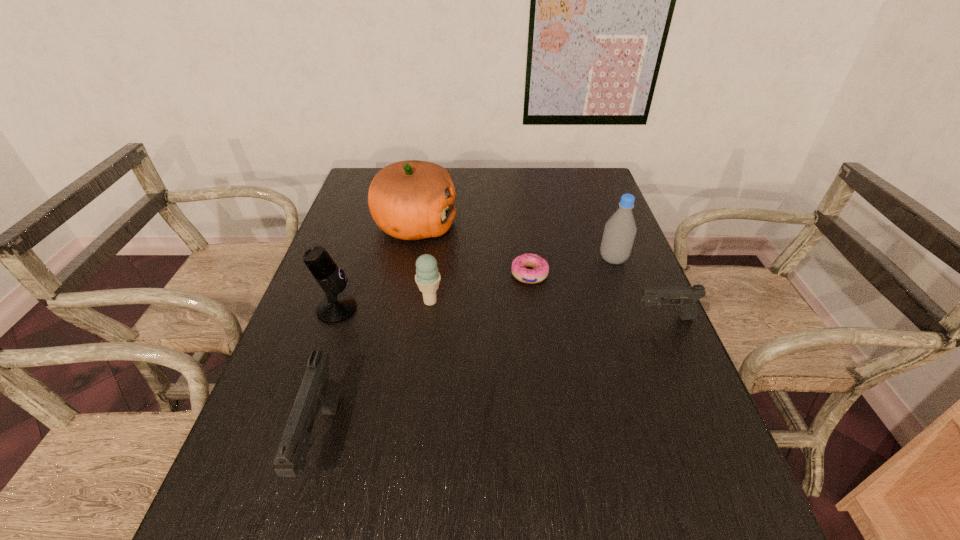
What are the coordinates of `vacant area that lies between the ice cream and the shorter pistol` in the screenshot? It's located at (547, 309).

This screenshot has height=540, width=960. I want to click on vacant area that lies between the bottle and the third object from right to left, so click(x=571, y=267).

Locate an element on the screen. Image resolution: width=960 pixels, height=540 pixels. vacant space that's between the ice cream and the nearer pistol is located at coordinates (375, 372).

The height and width of the screenshot is (540, 960). In order to click on empty space that is in between the bottle and the microphone in this screenshot , I will do `click(475, 284)`.

Locate an element on the screen. This screenshot has height=540, width=960. vacant area that lies between the doughnut and the farther pistol is located at coordinates (597, 296).

The height and width of the screenshot is (540, 960). Identify the location of vacant space in between the ice cream and the right pistol. [x=547, y=309].

Where is `the second closest object relative to the pumpkin`? The width and height of the screenshot is (960, 540). the second closest object relative to the pumpkin is located at coordinates (427, 277).

Point out which object is positioned as the third nearest to the microphone. Please provide its 2D coordinates. Your answer should be formatted as a tuple, i.e. [(x, y)], where the tuple contains the x and y coordinates of a point satisfying the conditions above.

[(318, 391)]

Find the location of a particular element. The image size is (960, 540). vacant point that satisfies the following two spatial constraints: 1. at the barrel of the farther pistol; 2. at the barrel of the taller pistol is located at coordinates (718, 442).